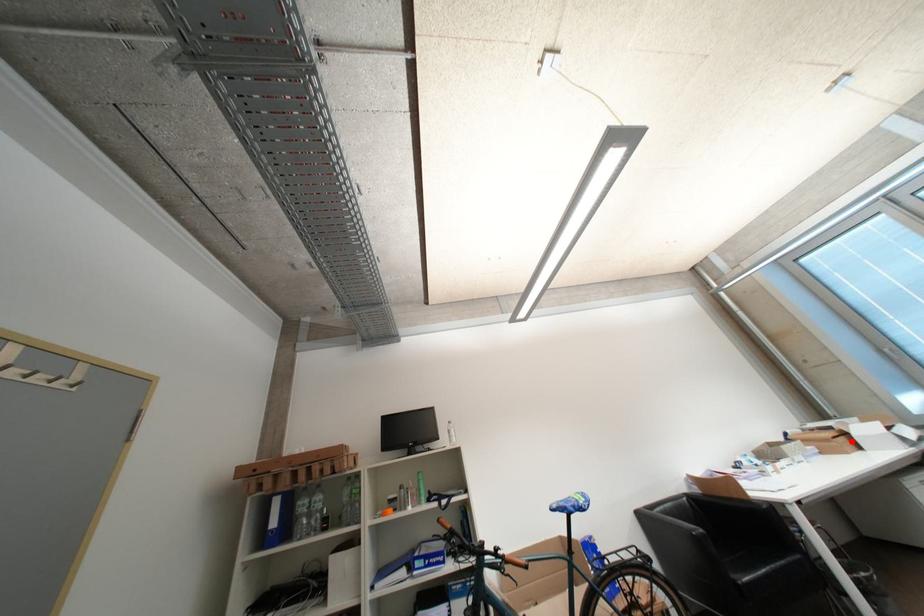
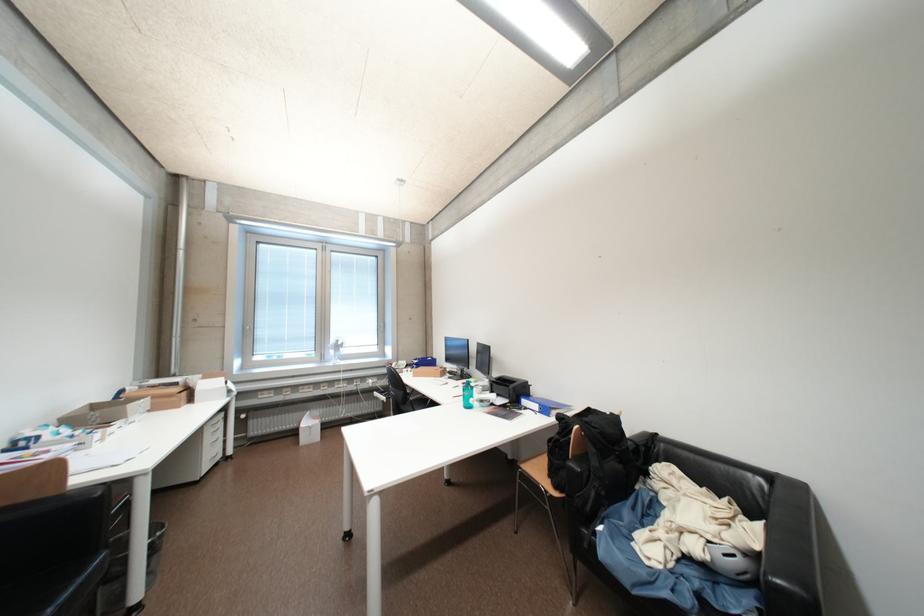
Question: I am providing you with two images of the same scene from different viewpoints. A red point is marked on the first image. Can you still see the location of the red point in image 2?

Choices:
 (A) Yes
 (B) No

Answer: (A)